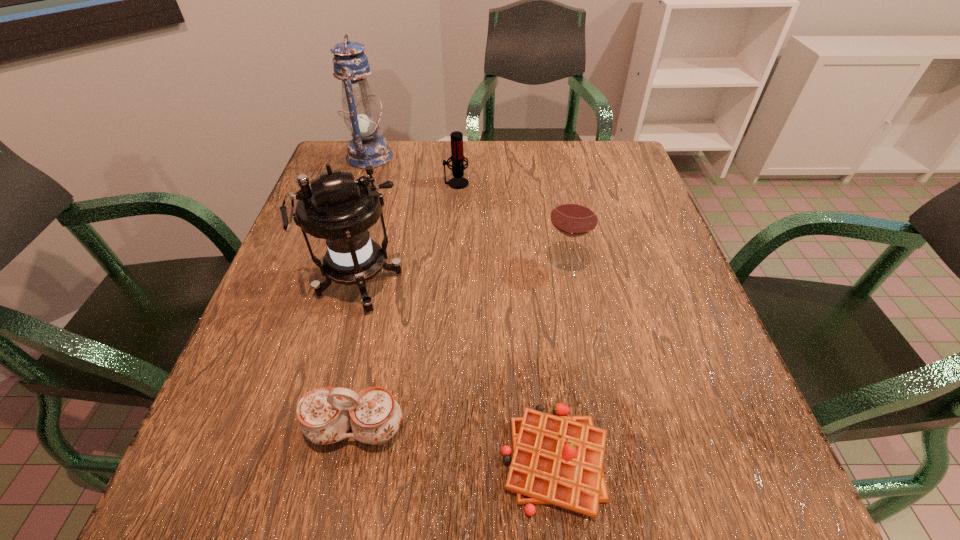
You are a GUI agent. You are given a task and a screenshot of the screen. Output one action in this format:
    pyautogui.click(x=<x>, y=<y>)
    Task: Click on the vacant point located between the farther lantern and the waffle
    
    Given the screenshot: What is the action you would take?
    pyautogui.click(x=463, y=308)

Identify which object is the third closest to the waffle. Please provide its 2D coordinates. Your answer should be formatted as a tuple, i.e. [(x, y)], where the tuple contains the x and y coordinates of a point satisfying the conditions above.

[(574, 214)]

Locate an element on the screen. This screenshot has height=540, width=960. object that is the closest one to the nearer lantern is located at coordinates (325, 417).

The height and width of the screenshot is (540, 960). I want to click on free spot that satisfies the following two spatial constraints: 1. on the front side of the third shortest object; 2. on the right side of the shortest object, so click(438, 460).

The image size is (960, 540). I want to click on free location that satisfies the following two spatial constraints: 1. on the front-facing side of the farthest object; 2. on the back side of the waffle, so click(x=270, y=460).

Locate an element on the screen. free spot that satisfies the following two spatial constraints: 1. on the back side of the fourth object from left to right; 2. on the front-facing side of the farthest object is located at coordinates (458, 157).

You are a GUI agent. You are given a task and a screenshot of the screen. Output one action in this format:
    pyautogui.click(x=<x>, y=<y>)
    Task: Click on the vacant space that satisfies the following two spatial constraints: 1. on the front-facing side of the farthest object; 2. on the right side of the nearer lantern
    The width and height of the screenshot is (960, 540).
    Given the screenshot: What is the action you would take?
    pyautogui.click(x=327, y=285)

Locate an element on the screen. The width and height of the screenshot is (960, 540). free space that satisfies the following two spatial constraints: 1. on the back side of the nearer lantern; 2. on the front-facing side of the farthest object is located at coordinates (393, 157).

Find the location of a particular element. This screenshot has width=960, height=540. free spot that satisfies the following two spatial constraints: 1. on the front-facing side of the second farthest object; 2. on the left side of the farther lantern is located at coordinates (361, 183).